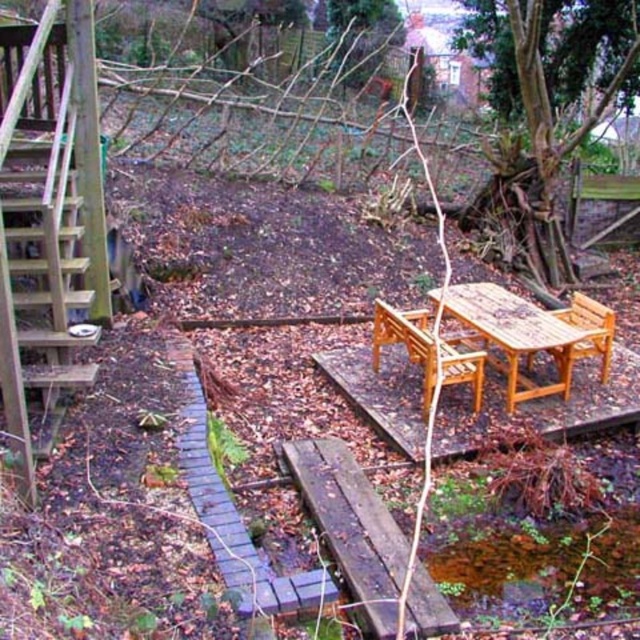
You are standing on the wooden deck and want to place a 15 feet long ladder between the wooden chair at center and the brick pathway. Will the ladder fit between them?

The distance between the wooden chair at center and the brick pathway is 17.15 feet. Since the ladder is 15 feet long, it will fit between them with some space to spare.

You are standing at point (406, 340) in the backyard. What object is located exactly at this point?

The wooden chair at center is located exactly at point (406, 340).